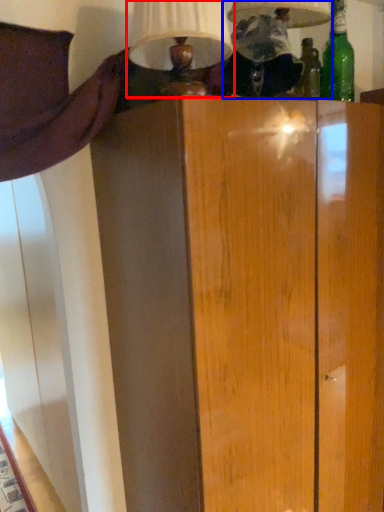
Question: Which object appears closest to the camera in this image, table lamp (highlighted by a red box) or table lamp (highlighted by a blue box)?

Choices:
 (A) table lamp
 (B) table lamp

Answer: (A)